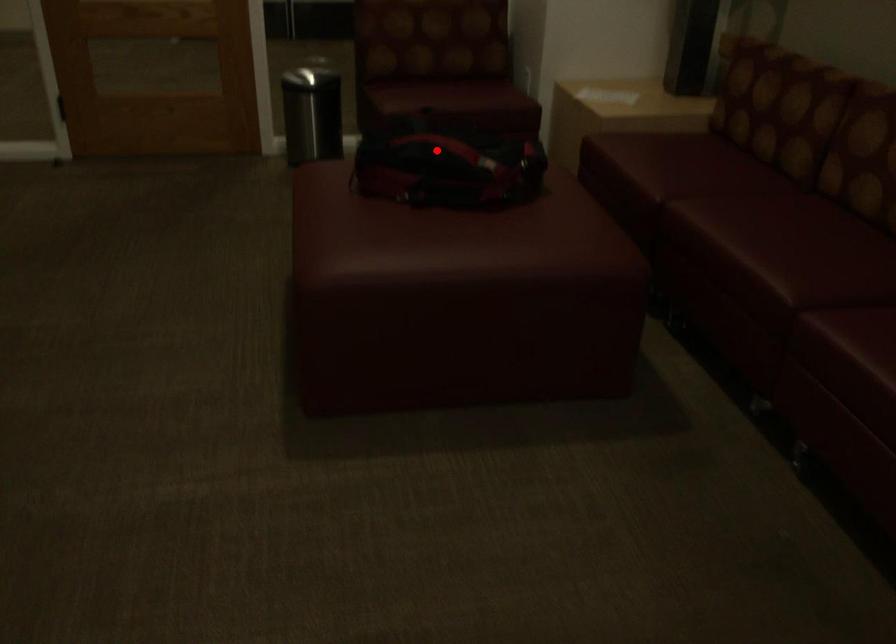
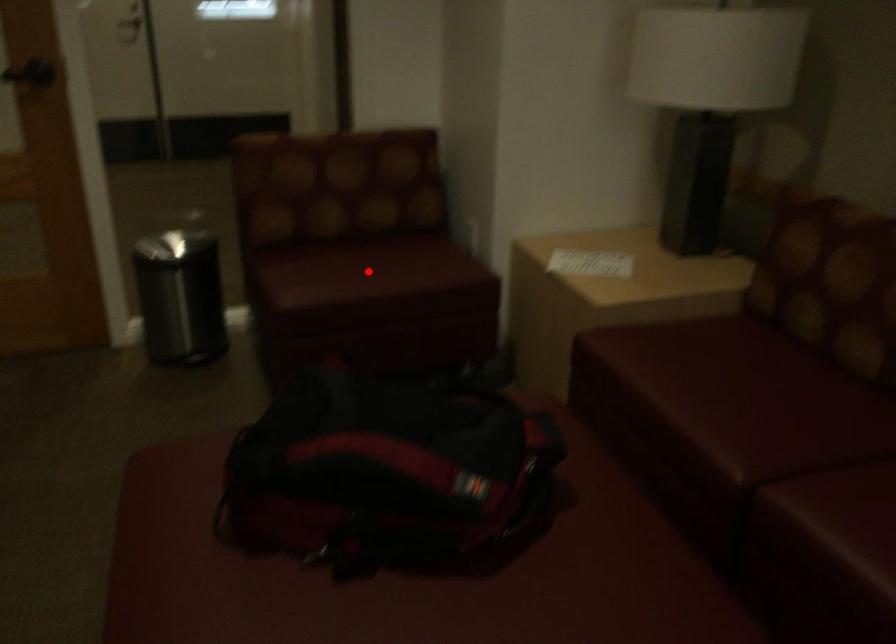
I am providing you with two images of the same scene from different viewpoints. A red point is marked on the first image and another point is marked on the second image. Does the point marked in image1 correspond to the same location as the one in image2?

No